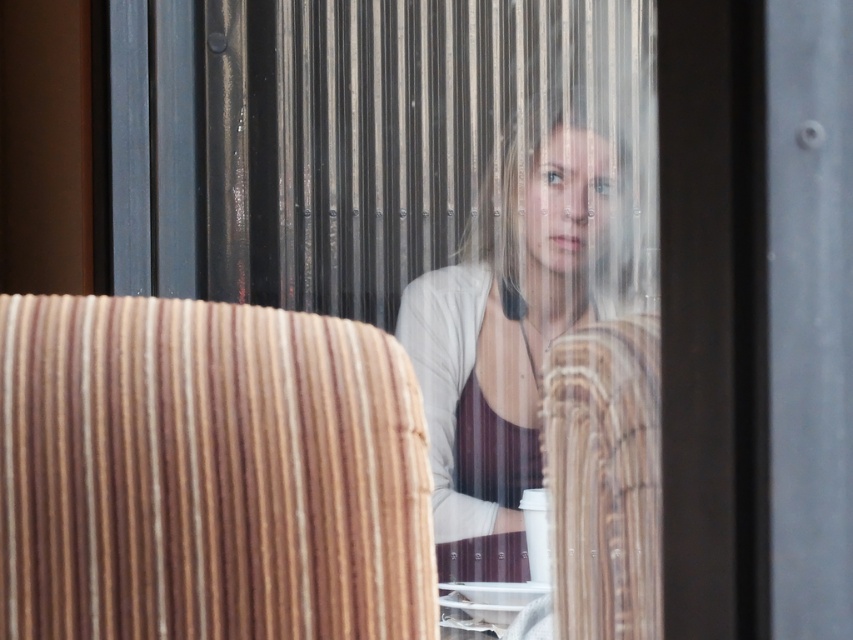
You are a photographer trying to capture a shot of the matte white shirt at center and the wooden armchair at center through the window. Since the window is slightly foggy, you can only focus on one object clearly. Which object should you choose to ensure it fits entirely within the frame if you want the wider object to be fully visible?

The matte white shirt at center is wider than the wooden armchair at center, so you should focus on the matte white shirt at center to ensure it fits entirely within the frame.

Looking at this image, you are a customer in the restaurant and want to sit down. There is a matte white shirt at center and a wooden armchair at center. Which object is closer to you?

The matte white shirt at center is closer to you because the wooden armchair at center is behind it.